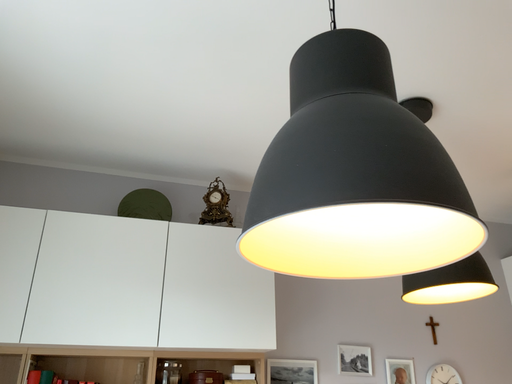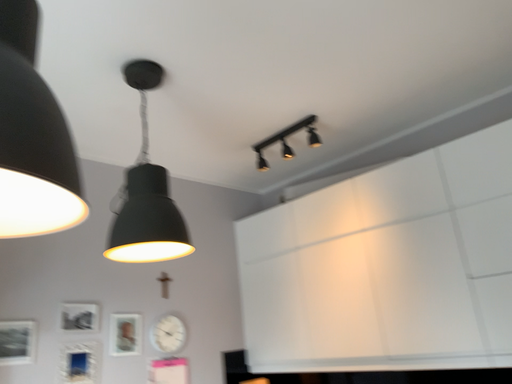
Question: How did the camera likely rotate when shooting the video?

Choices:
 (A) rotated left
 (B) rotated right

Answer: (B)